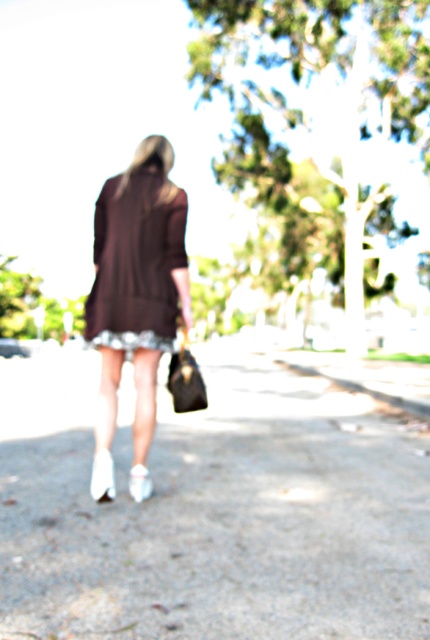
You are standing at the starting point and see the person wearing a matte brown coat at center. If you want to catch up with them before they reach the end of the path, which is 5 meters away from your current position, can you do it if you run at 6 meters per second and they continue walking at 1.5 meters per second?

The person wearing the matte brown coat at center is currently 4.58 meters away from you. Since the end of the path is 5 meters away, they have approximately 0.42 meters left to walk. At their speed of 1.5 mps, they will reach the end in about 0.28 seconds. If you run at 6 mps, you can cover the 4.58 meters in 0.76 seconds. Since your time is longer than theirs, you cannot catch up before they reach the end of the path.

You are a photographer trying to capture the white smooth pavement at center and the white leather shoe at lower center in a clear photo. Since both are white, how can you ensure they are distinguishable in the final image?

The white smooth pavement at center is positioned over the white leather shoe at lower center, so adjusting the camera angle to highlight the shadow or texture differences between them will help distinguish the two white objects.

You are a photographer trying to capture a closeup of the matte brown dress at center while standing on the white smooth pavement at center. Can you fit the entire dress into your camera frame without moving your position?

The white smooth pavement at center is wider than the matte brown dress at center, so yes, you can fit the entire dress into your camera frame while standing on the white smooth pavement at center.